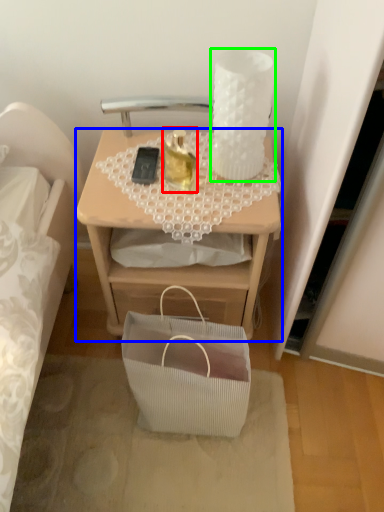
Question: Based on their relative distances, which object is nearer to candle holder (highlighted by a red box)? Choose from desk (highlighted by a blue box) and candle holder (highlighted by a green box).

Choices:
 (A) desk
 (B) candle holder

Answer: (B)